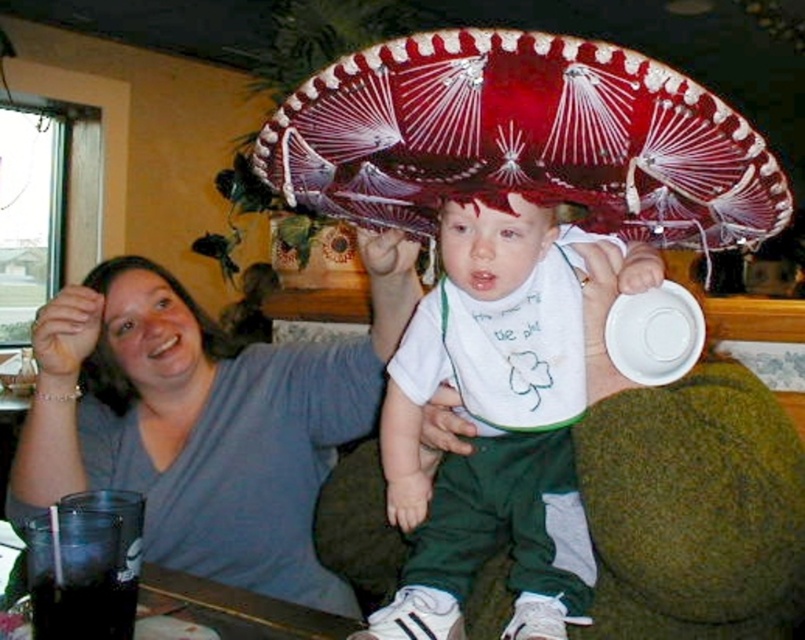
You are standing in the room and see the matte gray shirt at upper left and the matte gray head at upper left. Which object is located to the right of the other?

The matte gray shirt at upper left is positioned on the right side of matte gray head at upper left.

You are taking a photo of the scene and want to ensure both the matte gray shirt at upper left and the matte gray head at upper left are clearly visible. Which object should you focus on first to ensure it is in frame?

The matte gray shirt at upper left is larger in size than the matte gray head at upper left, so you should focus on the matte gray shirt at upper left first to ensure it is in frame.

In the scene shown: You are setting up a birthday party table and need to place a photo frame between the matte gray shirt at upper left and the white matte plate at center. Based on their positions, where should you place the photo frame?

The matte gray shirt at upper left is to the left of the white matte plate at center, so you should place the photo frame to the right of the matte gray shirt at upper left and to the left of the white matte plate at center to position it between them.